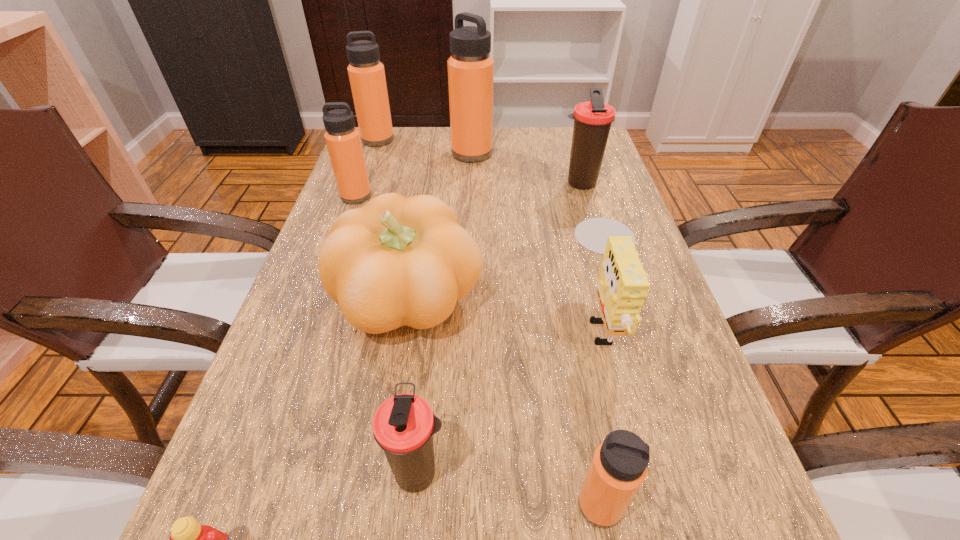
Identify the location of orange thermos bottle identified as the second closest to the second tallest object. (343, 140).

The width and height of the screenshot is (960, 540). What are the coordinates of `orange thermos bottle that can be found as the closest to the sponge` in the screenshot? It's located at (618, 468).

Where is `vacant region that satisfies the following two spatial constraints: 1. on the back side of the biggest orange thermos bottle; 2. on the right side of the pumpkin`? vacant region that satisfies the following two spatial constraints: 1. on the back side of the biggest orange thermos bottle; 2. on the right side of the pumpkin is located at coordinates (433, 153).

The width and height of the screenshot is (960, 540). I want to click on free space in the image that satisfies the following two spatial constraints: 1. on the back side of the tallest thermos bottle; 2. on the right side of the smaller brown thermos bottle, so click(x=450, y=153).

Image resolution: width=960 pixels, height=540 pixels. I want to click on blank area in the image that satisfies the following two spatial constraints: 1. on the back side of the second nearest orange thermos bottle; 2. on the right side of the right brown thermos bottle, so click(x=360, y=184).